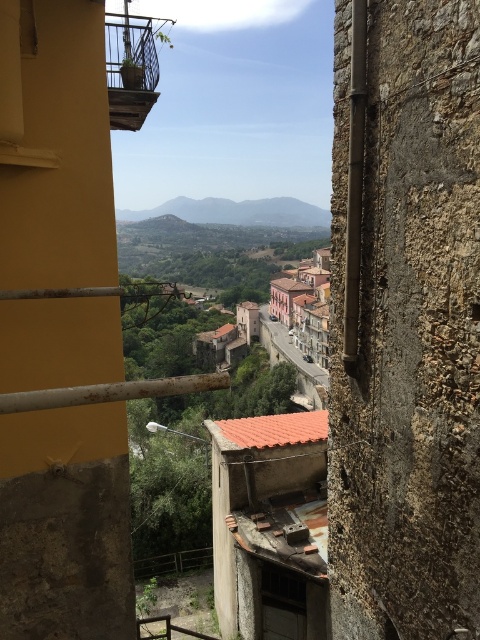
Who is higher up, terracotta tiled building at center or smooth stone alley at center?

Positioned higher is terracotta tiled building at center.

Which is more to the left, terracotta tiled building at center or smooth stone alley at center?

smooth stone alley at center

In order to click on terracotta tiled building at center in this screenshot , I will do [304, 305].

What are the coordinates of `terracotta tiled building at center` in the screenshot? It's located at (304, 305).

Can you confirm if green grassy hillside at center is thinner than smooth stone alley at center?

Incorrect, green grassy hillside at center's width is not less than smooth stone alley at center's.

Between green grassy hillside at center and smooth stone alley at center, which one appears on the right side from the viewer's perspective?

smooth stone alley at center is more to the right.

This screenshot has width=480, height=640. I want to click on green grassy hillside at center, so click(237, 211).

You are a GUI agent. You are given a task and a screenshot of the screen. Output one action in this format:
    pyautogui.click(x=<x>, y=<y>)
    Task: Click on the green grassy hillside at center
    Image resolution: width=480 pixels, height=640 pixels.
    Given the screenshot: What is the action you would take?
    pyautogui.click(x=237, y=211)

Does terracotta tiled building at center appear on the left side of green grassy hillside at center?

Incorrect, terracotta tiled building at center is not on the left side of green grassy hillside at center.

Is point (324, 364) in front of point (267, 211)?

Yes, it is.

Is point (294, 269) behind point (240, 220)?

No, it is not.

At what (x,y) coordinates should I click in order to perform the action: click on terracotta tiled building at center. Please return your answer as a coordinate pair (x, y). The height and width of the screenshot is (640, 480). Looking at the image, I should click on coord(304,305).